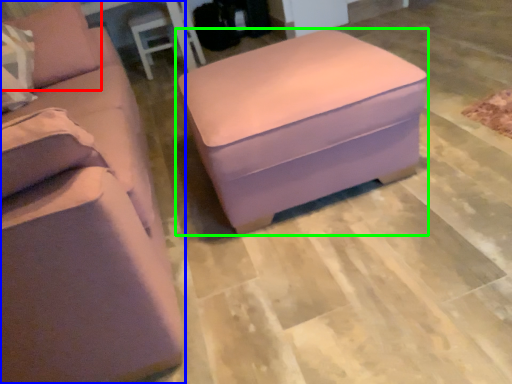
Question: Which is farther away from pillow (highlighted by a red box)? studio couch (highlighted by a blue box) or table (highlighted by a green box)?

Choices:
 (A) studio couch
 (B) table

Answer: (B)